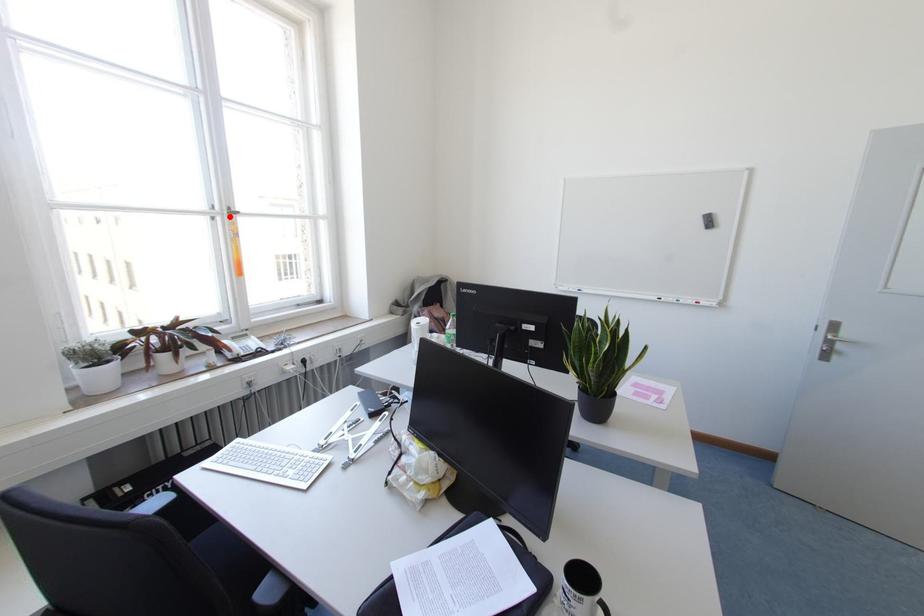
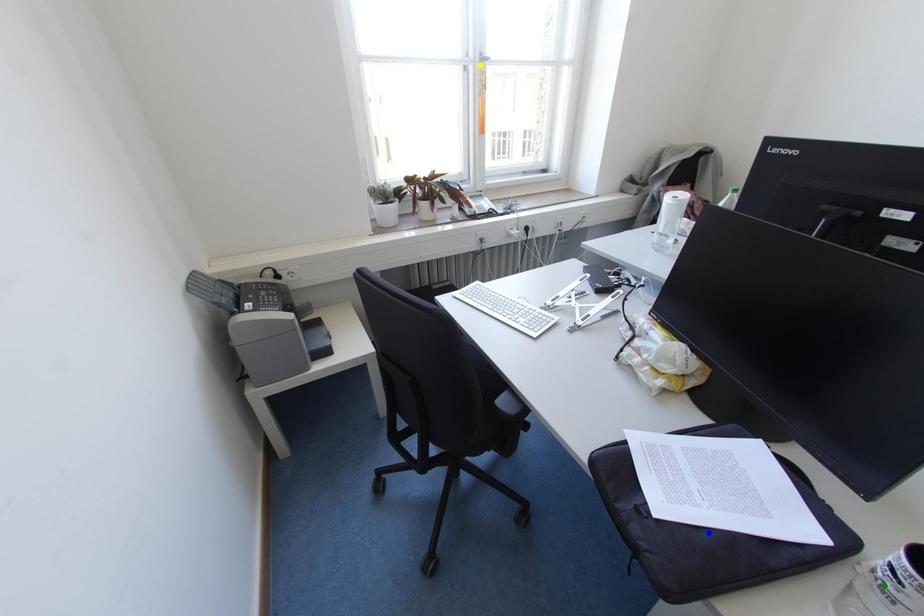
Question: I am providing you with two images of the same scene from different viewpoints. A red point is marked on the first image. You are given multiple points on the second image. Can you choose the point in image 2 that corresponds to the point in image 1?

Choices:
 (A) green point
 (B) blue point
 (C) yellow point

Answer: (C)